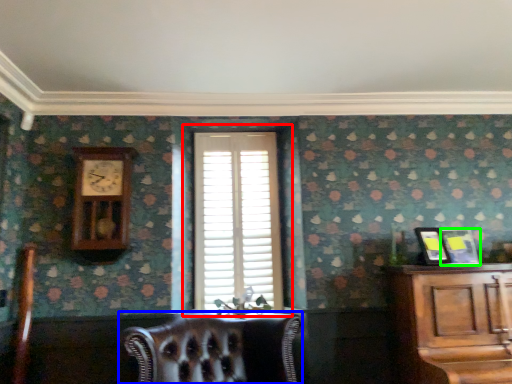
Question: Estimate the real-world distances between objects in this image. Which object is closer to window (highlighted by a red box), chair (highlighted by a blue box) or picture frame (highlighted by a green box)?

Choices:
 (A) chair
 (B) picture frame

Answer: (A)